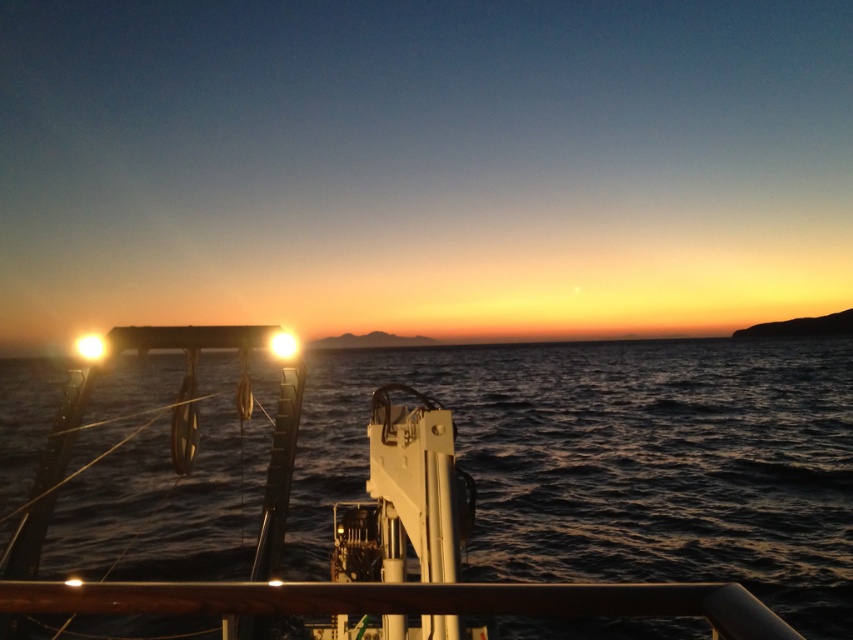
What is the 2D coordinate of the dark blue water at center?

The dark blue water at center is located at the 2D coordinate point of (618, 461).

You are standing on the deck of the ship and looking towards the horizon. Which object, the dark blue water at center or the brown polished wood rail at lower center, is higher from your viewpoint?

The dark blue water at center is higher than the brown polished wood rail at lower center from your viewpoint.